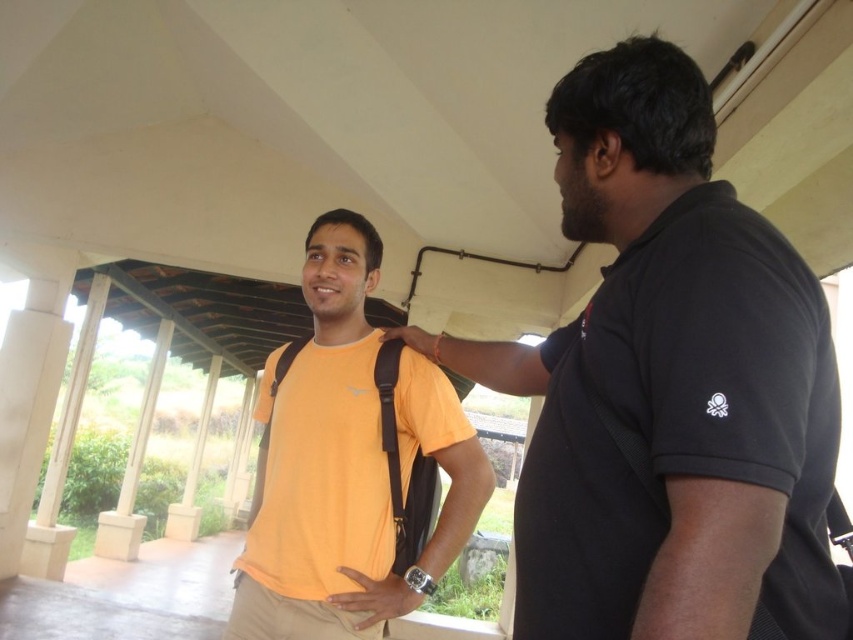
Question: Which point is closer to the camera?

Choices:
 (A) (776, 589)
 (B) (381, 561)

Answer: (A)

Question: Does black matte shirt at upper right appear on the right side of orange matte t-shirt at center?

Choices:
 (A) yes
 (B) no

Answer: (A)

Question: Which object is farther from the camera taking this photo?

Choices:
 (A) black matte shirt at upper right
 (B) orange matte t-shirt at center

Answer: (B)

Question: Does black matte shirt at upper right appear on the left side of orange matte t-shirt at center?

Choices:
 (A) yes
 (B) no

Answer: (B)

Question: Which point is farther to the camera?

Choices:
 (A) (328, 476)
 (B) (807, 518)

Answer: (A)

Question: In this image, where is black matte shirt at upper right located relative to orange matte t-shirt at center?

Choices:
 (A) right
 (B) left

Answer: (A)